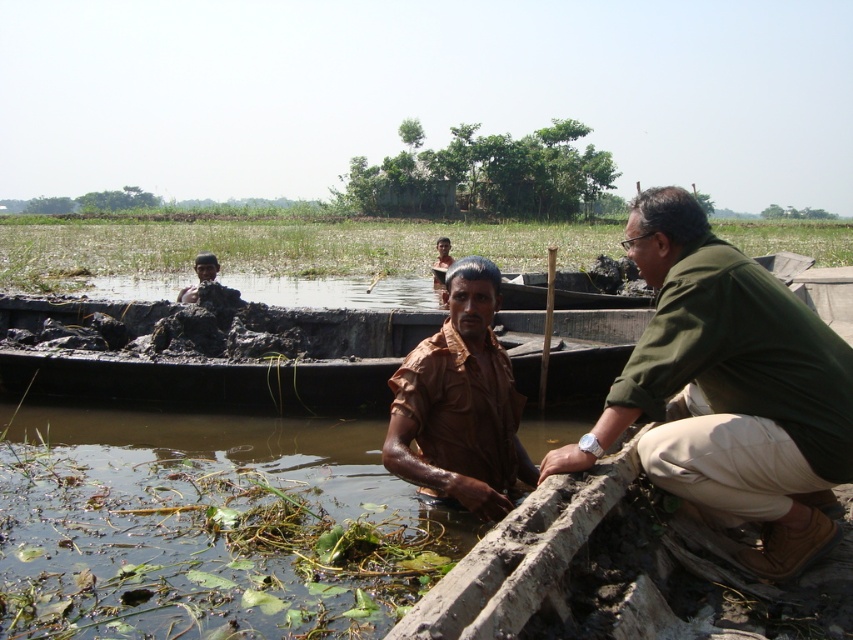
Is green fabric shirt at right thinner than dark brown mud at center?

Indeed, green fabric shirt at right has a lesser width compared to dark brown mud at center.

Can you confirm if green fabric shirt at right is positioned below dark brown mud at center?

Yes, green fabric shirt at right is below dark brown mud at center.

Is point (757, 308) in front of point (73, 305)?

Yes, it is.

You are a GUI agent. You are given a task and a screenshot of the screen. Output one action in this format:
    pyautogui.click(x=<x>, y=<y>)
    Task: Click on the green fabric shirt at right
    
    Given the screenshot: What is the action you would take?
    pyautogui.click(x=729, y=390)

Is point (33, 337) positioned behind point (463, 332)?

Yes.

Does point (602, 369) come closer to viewer compared to point (428, 484)?

No, it is behind (428, 484).

Identify the location of dark brown mud at center. (206, 352).

How much distance is there between brown matte shirt at center and brown matte head at upper left?

They are 5.41 meters apart.

Is brown matte shirt at center taller than brown matte head at upper left?

Correct, brown matte shirt at center is much taller as brown matte head at upper left.

Where is `brown matte shirt at center`? brown matte shirt at center is located at coordinates (460, 403).

I want to click on brown matte shirt at center, so click(x=460, y=403).